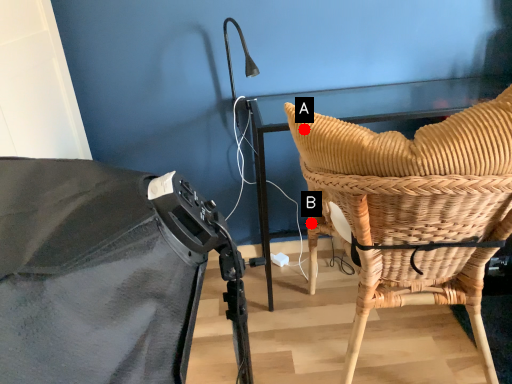
Question: Two points are circled on the image, labeled by A and B beside each circle. Which point appears closest to the camera in this image?

Choices:
 (A) A is closer
 (B) B is closer

Answer: (A)